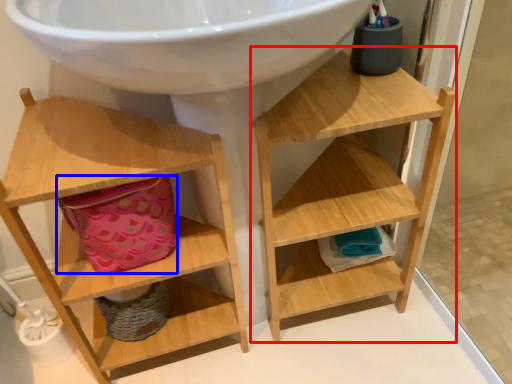
Question: Which of the following is the closest to the observer, shelf (highlighted by a red box) or basket (highlighted by a blue box)?

Choices:
 (A) shelf
 (B) basket

Answer: (A)